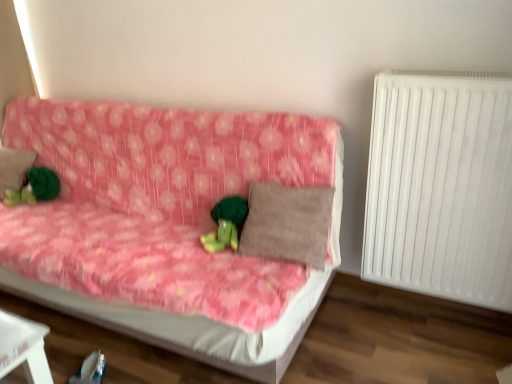
Question: Is brown fabric pillow at left, the second pillow when ordered from right to left, positioned in front of pink floral fabric couch at center?

Choices:
 (A) no
 (B) yes

Answer: (A)

Question: From the image's perspective, is brown fabric pillow at left, which is counted as the 1th pillow, starting from the left, above pink floral fabric couch at center?

Choices:
 (A) yes
 (B) no

Answer: (A)

Question: Could you tell me if brown fabric pillow at left, arranged as the second pillow when viewed from the front, is facing pink floral fabric couch at center?

Choices:
 (A) no
 (B) yes

Answer: (B)

Question: Does brown fabric pillow at left, the second pillow when ordered from right to left, have a larger size compared to pink floral fabric couch at center?

Choices:
 (A) yes
 (B) no

Answer: (B)

Question: Considering the relative sizes of brown fabric pillow at left, arranged as the second pillow when viewed from the front, and pink floral fabric couch at center in the image provided, is brown fabric pillow at left, arranged as the second pillow when viewed from the front, smaller than pink floral fabric couch at center?

Choices:
 (A) no
 (B) yes

Answer: (B)

Question: Is brown fabric pillow at left, which is counted as the 1th pillow, starting from the left, beside pink floral fabric couch at center?

Choices:
 (A) no
 (B) yes

Answer: (A)

Question: Is brown fabric pillow at left, arranged as the second pillow when viewed from the front, a part of green plush toy at center, the 2th toy from the back?

Choices:
 (A) yes
 (B) no

Answer: (B)

Question: From the image's perspective, is green plush toy at center, which is the 1th toy from right to left, on brown fabric pillow at left, arranged as the second pillow when viewed from the front?

Choices:
 (A) no
 (B) yes

Answer: (A)

Question: Considering the relative sizes of green plush toy at center, the 2th toy from the back, and brown fabric pillow at left, arranged as the second pillow when viewed from the front, in the image provided, is green plush toy at center, the 2th toy from the back, smaller than brown fabric pillow at left, arranged as the second pillow when viewed from the front,?

Choices:
 (A) yes
 (B) no

Answer: (A)

Question: Is green plush toy at center, the 2th toy from the back, aimed at brown fabric pillow at left, which is counted as the 1th pillow, starting from the left?

Choices:
 (A) yes
 (B) no

Answer: (B)

Question: Does green plush toy at center, positioned as the 2th toy in left-to-right order, have a greater height compared to brown fabric pillow at left, arranged as the second pillow when viewed from the front?

Choices:
 (A) no
 (B) yes

Answer: (A)

Question: From a real-world perspective, is green plush toy at center, which is the first toy from front to back, positioned over brown fabric pillow at left, arranged as the first pillow when viewed from the back, based on gravity?

Choices:
 (A) yes
 (B) no

Answer: (B)

Question: Considering the relative positions of white plastic radiator at right and green plush toy at center, the 2th toy from the back, in the image provided, is white plastic radiator at right to the right of green plush toy at center, the 2th toy from the back, from the viewer's perspective?

Choices:
 (A) no
 (B) yes

Answer: (B)